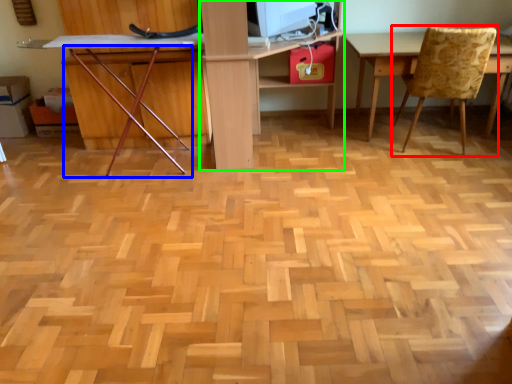
Question: Considering the real-world distances, which object is closest to chair (highlighted by a red box)? chair (highlighted by a blue box) or computer desk (highlighted by a green box).

Choices:
 (A) chair
 (B) computer desk

Answer: (B)